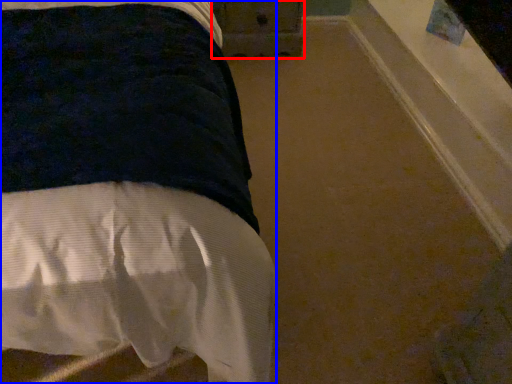
Question: Which point is closer to the camera, drawer (highlighted by a red box) or bed (highlighted by a blue box)?

Choices:
 (A) drawer
 (B) bed

Answer: (B)